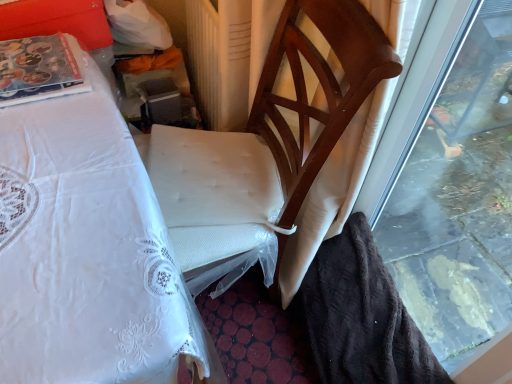
Question: Based on their sizes in the image, would you say beige textured radiator at center is bigger or smaller than wooden chair at center?

Choices:
 (A) big
 (B) small

Answer: (B)

Question: From the image's perspective, is beige textured radiator at center positioned above or below wooden chair at center?

Choices:
 (A) above
 (B) below

Answer: (A)

Question: Considering the real-world distances, which object is closest to the wooden chair at center?

Choices:
 (A) beige textured radiator at center
 (B) transparent glass window at right

Answer: (A)

Question: Which is nearer to the wooden chair at center?

Choices:
 (A) beige textured radiator at center
 (B) transparent glass window at right

Answer: (A)